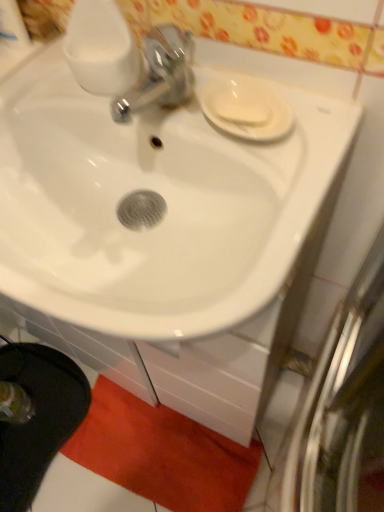
Question: Should I look upward or downward to see white matte soap at upper right?

Choices:
 (A) down
 (B) up

Answer: (B)

Question: Is white matte soap at upper right not close to orange plush bath mat at lower center?

Choices:
 (A) yes
 (B) no

Answer: (B)

Question: From the image's perspective, would you say white matte soap at upper right is shown under orange plush bath mat at lower center?

Choices:
 (A) no
 (B) yes

Answer: (A)

Question: Is white matte soap at upper right aimed at orange plush bath mat at lower center?

Choices:
 (A) yes
 (B) no

Answer: (B)

Question: Is orange plush bath mat at lower center at the back of white matte soap at upper right?

Choices:
 (A) yes
 (B) no

Answer: (B)

Question: Considering the relative positions of white matte soap at upper right and orange plush bath mat at lower center in the image provided, is white matte soap at upper right to the right of orange plush bath mat at lower center from the viewer's perspective?

Choices:
 (A) yes
 (B) no

Answer: (A)

Question: Does white matte soap at upper right appear on the left side of orange plush bath mat at lower center?

Choices:
 (A) yes
 (B) no

Answer: (B)

Question: Is white glossy sink at center turned away from white glossy saucer at upper right?

Choices:
 (A) yes
 (B) no

Answer: (B)

Question: Can you confirm if white glossy sink at center is shorter than white glossy saucer at upper right?

Choices:
 (A) yes
 (B) no

Answer: (B)

Question: Does white glossy sink at center appear on the left side of white glossy saucer at upper right?

Choices:
 (A) yes
 (B) no

Answer: (A)

Question: Is white glossy sink at center in contact with white glossy saucer at upper right?

Choices:
 (A) no
 (B) yes

Answer: (A)

Question: Is white glossy sink at center facing towards white glossy saucer at upper right?

Choices:
 (A) no
 (B) yes

Answer: (A)

Question: From the image's perspective, is white glossy sink at center located above white glossy saucer at upper right?

Choices:
 (A) no
 (B) yes

Answer: (A)

Question: Is orange plush bath mat at lower center at the right side of white matte soap at upper right?

Choices:
 (A) yes
 (B) no

Answer: (B)